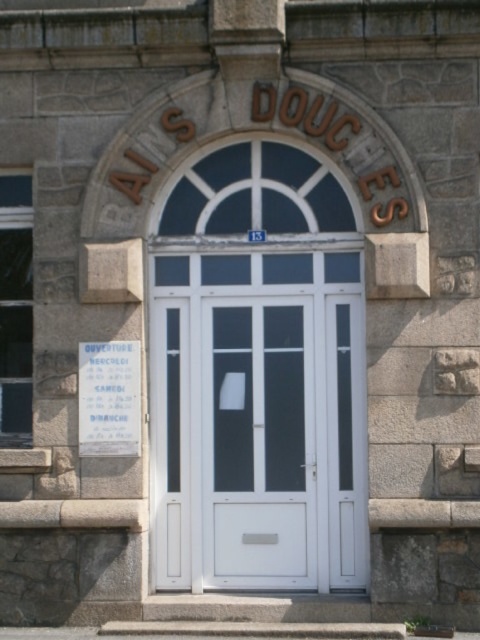
Is white matte door at center to the left of gray stone stairs at lower center from the viewer's perspective?

No, white matte door at center is not to the left of gray stone stairs at lower center.

Measure the distance between point [277,481] and camera.

They are 10.68 meters apart.

Where is `white matte door at center`? white matte door at center is located at coordinates (259, 444).

Does white glossy door at center appear on the left side of gray stone stairs at lower center?

Incorrect, white glossy door at center is not on the left side of gray stone stairs at lower center.

What do you see at coordinates (259, 420) in the screenshot? I see `white glossy door at center` at bounding box center [259, 420].

Image resolution: width=480 pixels, height=640 pixels. Identify the location of white glossy door at center. (259, 420).

Does white glossy door at center have a greater height compared to white matte door at center?

Correct, white glossy door at center is much taller as white matte door at center.

Is point (356, 452) closer to viewer compared to point (269, 541)?

Yes, it is in front of point (269, 541).

This screenshot has width=480, height=640. In order to click on white glossy door at center in this screenshot , I will do `click(259, 420)`.